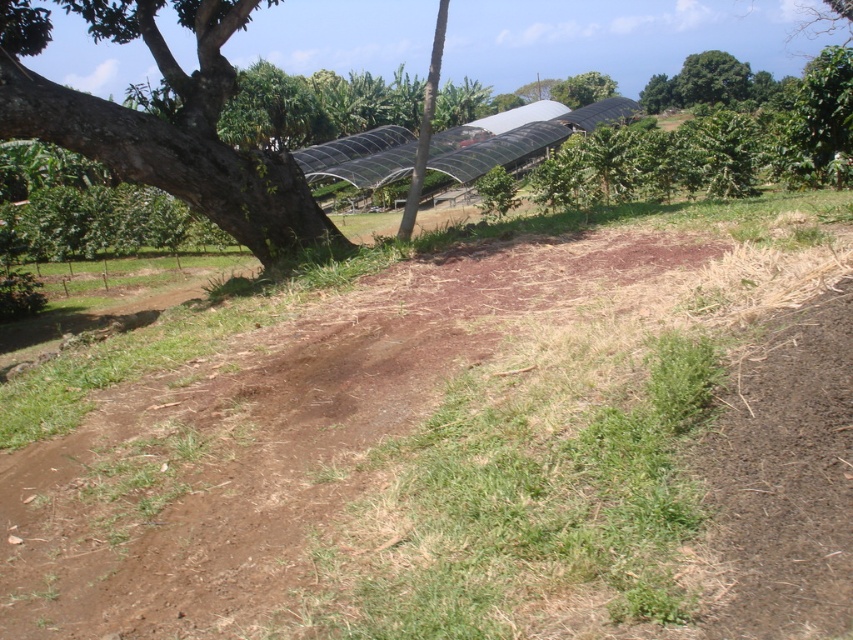
Describe the element at coordinates (460, 445) in the screenshot. Image resolution: width=853 pixels, height=640 pixels. I see `brown soil at center` at that location.

I want to click on brown soil at center, so click(460, 445).

Where is `brown soil at center`? brown soil at center is located at coordinates (460, 445).

In the scene shown: Does green leafy tree at center have a lesser width compared to green leafy tree at upper center?

Yes, green leafy tree at center is thinner than green leafy tree at upper center.

Measure the distance between point (x=426, y=104) and camera.

Point (x=426, y=104) and camera are 26.45 feet apart from each other.

The width and height of the screenshot is (853, 640). What are the coordinates of `green leafy tree at center` in the screenshot? It's located at (424, 125).

Describe the element at coordinates (817, 124) in the screenshot. The height and width of the screenshot is (640, 853). I see `green leafy tree at upper right` at that location.

The height and width of the screenshot is (640, 853). What do you see at coordinates (817, 124) in the screenshot? I see `green leafy tree at upper right` at bounding box center [817, 124].

The height and width of the screenshot is (640, 853). What are the coordinates of `green leafy tree at upper right` in the screenshot? It's located at (817, 124).